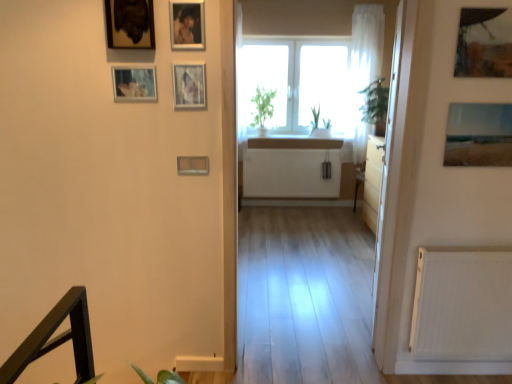
Question: Is metallic silver picture frame at upper center, which appears as the 5th picture frame when viewed from the left, facing away from matte plastic picture frame at center, which ranks as the fifth picture frame in right-to-left order?

Choices:
 (A) no
 (B) yes

Answer: (A)

Question: From the image's perspective, is metallic silver picture frame at upper center, which appears as the 5th picture frame when viewed from the left, beneath matte plastic picture frame at center, the third picture frame positioned from the left?

Choices:
 (A) no
 (B) yes

Answer: (A)

Question: Can you confirm if metallic silver picture frame at upper center, which appears as the 5th picture frame when viewed from the left, is smaller than matte plastic picture frame at center, which ranks as the fifth picture frame in right-to-left order?

Choices:
 (A) yes
 (B) no

Answer: (B)

Question: From a real-world perspective, is metallic silver picture frame at upper center, which appears as the 5th picture frame when viewed from the left, over matte plastic picture frame at center, which ranks as the fifth picture frame in right-to-left order?

Choices:
 (A) no
 (B) yes

Answer: (B)

Question: Would you say matte plastic picture frame at center, the third picture frame positioned from the left, is part of metallic silver picture frame at upper center, which ranks as the 3th picture frame in right-to-left order,'s contents?

Choices:
 (A) no
 (B) yes

Answer: (A)

Question: From the image's perspective, is white matte radiator at right located above or below metallic silver picture frame at upper left, the seventh picture frame positioned from the right?

Choices:
 (A) above
 (B) below

Answer: (B)

Question: In terms of width, does white matte radiator at right look wider or thinner when compared to metallic silver picture frame at upper left, the first picture frame in the left-to-right sequence?

Choices:
 (A) wide
 (B) thin

Answer: (A)

Question: Based on their positions, is white matte radiator at right located to the left or right of metallic silver picture frame at upper left, the seventh picture frame positioned from the right?

Choices:
 (A) right
 (B) left

Answer: (A)

Question: Is white matte radiator at right in front of or behind metallic silver picture frame at upper left, the seventh picture frame positioned from the right, in the image?

Choices:
 (A) behind
 (B) front

Answer: (A)

Question: Looking at their shapes, would you say matte glass landscape photo at upper right, placed as the seventh picture frame when sorted from left to right, is wider or thinner than wooden framed painting at upper left, acting as the sixth picture frame starting from the right?

Choices:
 (A) thin
 (B) wide

Answer: (A)

Question: From a real-world perspective, is matte glass landscape photo at upper right, the first picture frame viewed from the right, physically located above or below wooden framed painting at upper left, acting as the sixth picture frame starting from the right?

Choices:
 (A) above
 (B) below

Answer: (B)

Question: Considering the positions of matte glass landscape photo at upper right, placed as the seventh picture frame when sorted from left to right, and wooden framed painting at upper left, which appears as the 2th picture frame when viewed from the left, in the image, is matte glass landscape photo at upper right, placed as the seventh picture frame when sorted from left to right, taller or shorter than wooden framed painting at upper left, which appears as the 2th picture frame when viewed from the left,?

Choices:
 (A) tall
 (B) short

Answer: (B)

Question: From the image's perspective, is matte glass landscape photo at upper right, placed as the seventh picture frame when sorted from left to right, above or below wooden framed painting at upper left, which appears as the 2th picture frame when viewed from the left?

Choices:
 (A) below
 (B) above

Answer: (A)

Question: Is metallic photo frame at upper center, placed as the 4th picture frame when sorted from right to left, bigger or smaller than transparent glass door at right?

Choices:
 (A) big
 (B) small

Answer: (B)

Question: From the image's perspective, is metallic photo frame at upper center, arranged as the 4th picture frame when viewed from the left, positioned above or below transparent glass door at right?

Choices:
 (A) below
 (B) above

Answer: (B)